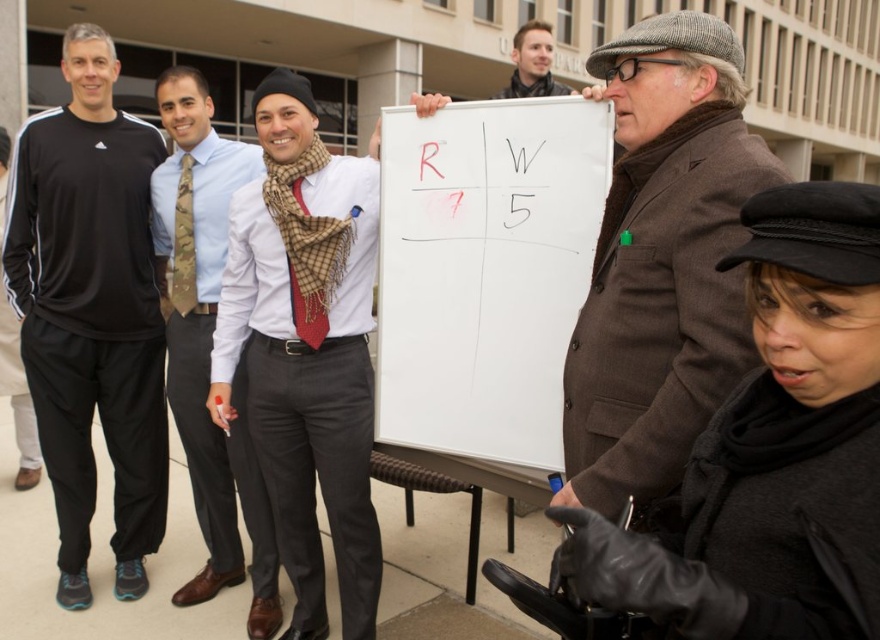
Question: Considering the relative positions of white matte board at center and black athletic wear at left in the image provided, where is white matte board at center located with respect to black athletic wear at left?

Choices:
 (A) left
 (B) right

Answer: (B)

Question: Which point appears closest to the camera in this image?

Choices:
 (A) (489, 200)
 (B) (181, 372)
 (C) (108, 92)

Answer: (A)

Question: Observing the image, what is the correct spatial positioning of white matte board at center in reference to camo tie at center?

Choices:
 (A) below
 (B) above

Answer: (B)

Question: Among these objects, which one is nearest to the camera?

Choices:
 (A) black leather gloves at lower right
 (B) white matte board at center
 (C) plaid scarf at center
 (D) black athletic wear at left

Answer: (A)

Question: Considering the real-world distances, which object is farthest from the white matte board at center?

Choices:
 (A) smooth brown leather jacket at upper center
 (B) camo tie at center

Answer: (A)

Question: Is black athletic wear at left further to camera compared to smooth brown leather jacket at upper center?

Choices:
 (A) yes
 (B) no

Answer: (B)